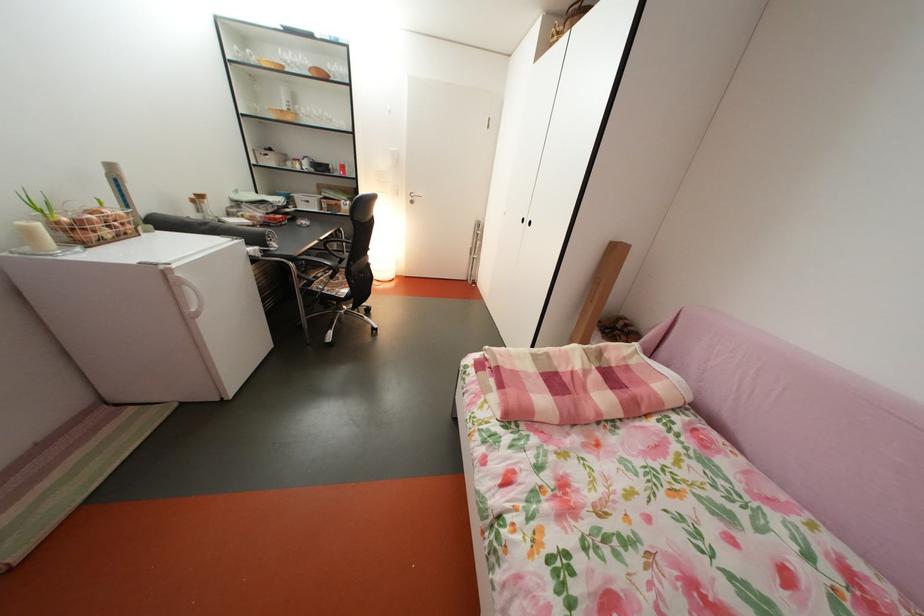
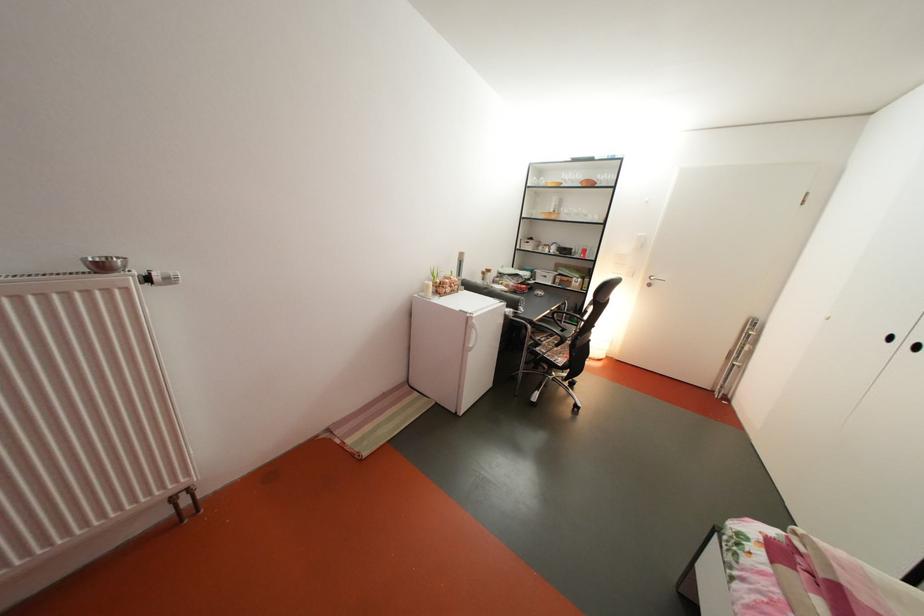
Locate, in the second image, the point that corresponds to (x=300, y=71) in the first image.

(578, 188)